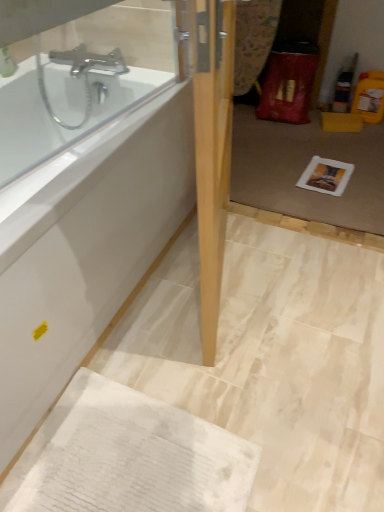
Locate an element on the screen. vacant position to the left of transparent glass door at center is located at coordinates (198, 266).